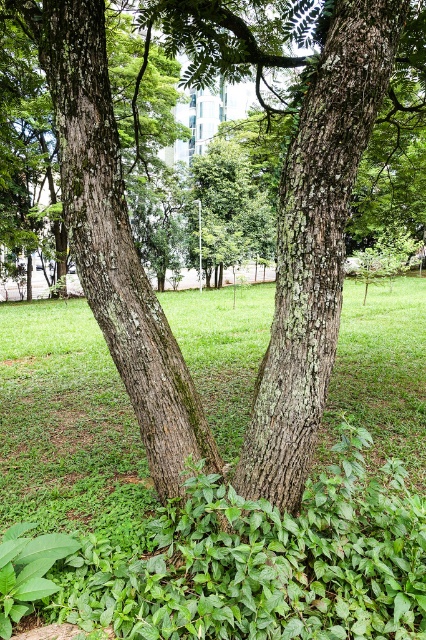
You are a gardener who needs to mow the lawn. You see the green leafy grass at center and the green rough bark tree trunk at left. Which one is shorter?

The green leafy grass at center is shorter than the green rough bark tree trunk at left.

You are standing in the park and want to take a photo of the smooth bark tree trunk at center without the green leafy grass at center blocking the view. Is this possible?

The green leafy grass at center is in front of the smooth bark tree trunk at center, so it will block the view. To take a photo of the smooth bark tree trunk at center without the grass blocking it, you would need to move to a position where the grass is not between you and the tree trunk.

You are a park visitor standing at the entrance of the park. You see the smooth bark tree trunk at center and the green rough bark tree trunk at left. Which tree trunk is positioned more to your left side?

The green rough bark tree trunk at left is positioned more to your left side than the smooth bark tree trunk at center.